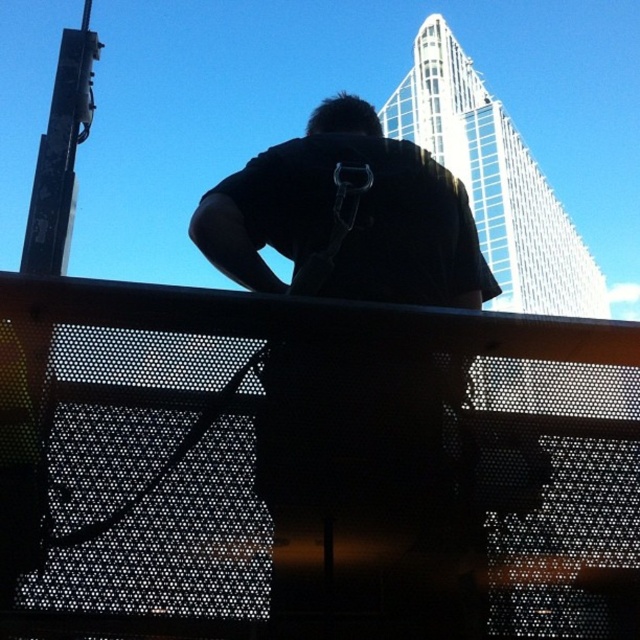
Question: Is the position of perforated metal fence at center more distant than that of black matte shirt at center?

Choices:
 (A) no
 (B) yes

Answer: (A)

Question: Can you confirm if perforated metal fence at center is positioned to the left of black matte shirt at center?

Choices:
 (A) yes
 (B) no

Answer: (A)

Question: Does perforated metal fence at center appear on the right side of black matte shirt at center?

Choices:
 (A) yes
 (B) no

Answer: (B)

Question: Which object appears closest to the camera in this image?

Choices:
 (A) black matte shirt at center
 (B) perforated metal fence at center

Answer: (B)